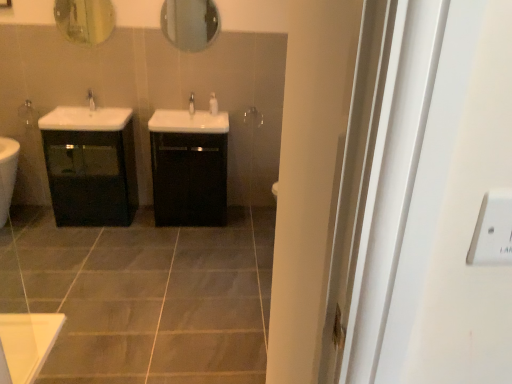
Question: Could you tell me if white glossy soap dispenser at center is turned towards black glossy cabinet at center, which appears as the 2th bathroom cabinet when viewed from the left?

Choices:
 (A) yes
 (B) no

Answer: (B)

Question: Is white glossy soap dispenser at center oriented away from black glossy cabinet at center, arranged as the 1th bathroom cabinet when viewed from the right?

Choices:
 (A) yes
 (B) no

Answer: (B)

Question: Can you confirm if white glossy soap dispenser at center is shorter than black glossy cabinet at center, arranged as the 1th bathroom cabinet when viewed from the right?

Choices:
 (A) yes
 (B) no

Answer: (A)

Question: Is white glossy soap dispenser at center not close to black glossy cabinet at center, which appears as the 2th bathroom cabinet when viewed from the left?

Choices:
 (A) yes
 (B) no

Answer: (B)

Question: From the image's perspective, is white glossy soap dispenser at center beneath black glossy cabinet at center, arranged as the 1th bathroom cabinet when viewed from the right?

Choices:
 (A) yes
 (B) no

Answer: (B)

Question: Is white glossy soap dispenser at center positioned behind black glossy cabinet at center, which appears as the 2th bathroom cabinet when viewed from the left?

Choices:
 (A) yes
 (B) no

Answer: (A)

Question: Is white glossy soap dispenser at center shorter than white glossy tap at center, the 2th tap positioned from the left?

Choices:
 (A) yes
 (B) no

Answer: (B)

Question: Can you confirm if white glossy soap dispenser at center is taller than white glossy tap at center, the 2th tap positioned from the left?

Choices:
 (A) yes
 (B) no

Answer: (A)

Question: Does white glossy soap dispenser at center have a greater width compared to white glossy tap at center, the 2th tap positioned from the left?

Choices:
 (A) no
 (B) yes

Answer: (A)

Question: Is white glossy soap dispenser at center thinner than white glossy tap at center, which appears as the 1th tap when viewed from the right?

Choices:
 (A) no
 (B) yes

Answer: (B)

Question: Can you confirm if white glossy soap dispenser at center is positioned to the left of white glossy tap at center, which appears as the 1th tap when viewed from the right?

Choices:
 (A) no
 (B) yes

Answer: (A)

Question: From a real-world perspective, is white glossy soap dispenser at center physically below white glossy tap at center, the 2th tap positioned from the left?

Choices:
 (A) yes
 (B) no

Answer: (B)

Question: From the image's perspective, is white glossy tap at center, the 2th tap positioned from the left, located beneath white glossy soap dispenser at center?

Choices:
 (A) yes
 (B) no

Answer: (A)